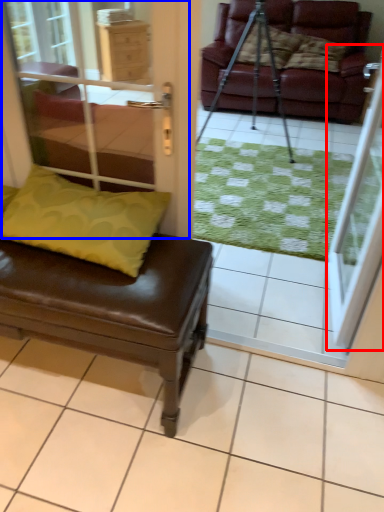
Question: Which object is closer to the camera taking this photo, screen door (highlighted by a red box) or screen door (highlighted by a blue box)?

Choices:
 (A) screen door
 (B) screen door

Answer: (B)